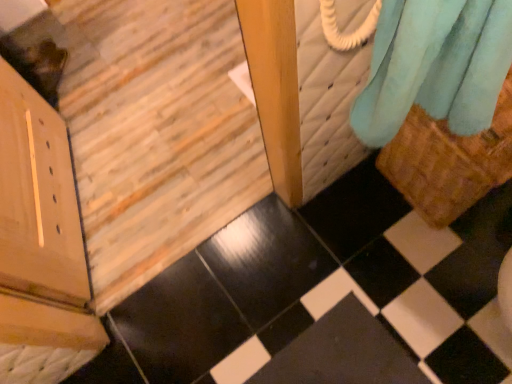
Question: In the image, is soft blue fabric at upper right positioned in front of or behind wooden door at lower left?

Choices:
 (A) behind
 (B) front

Answer: (A)

Question: In terms of width, does soft blue fabric at upper right look wider or thinner when compared to wooden door at lower left?

Choices:
 (A) thin
 (B) wide

Answer: (B)

Question: Which of these objects is positioned farthest from the wooden door at lower left?

Choices:
 (A) soft blue fabric at upper right
 (B) black glossy tile at lower right

Answer: (A)

Question: Based on their relative distances, which object is farther from the wooden door at lower left?

Choices:
 (A) black glossy tile at lower right
 (B) soft blue fabric at upper right

Answer: (B)